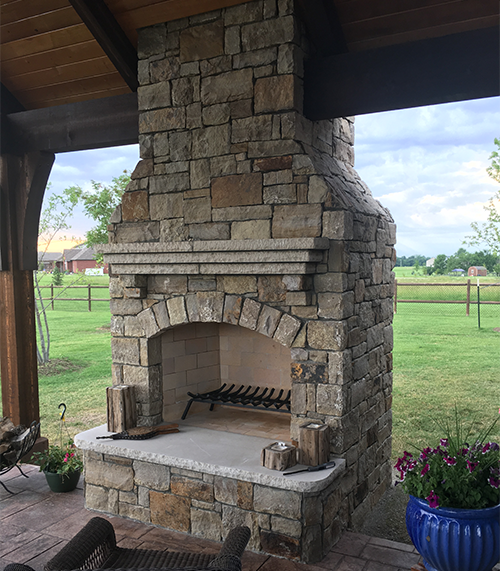
The width and height of the screenshot is (500, 571). Identify the location of potted plants. (65, 465), (463, 505).